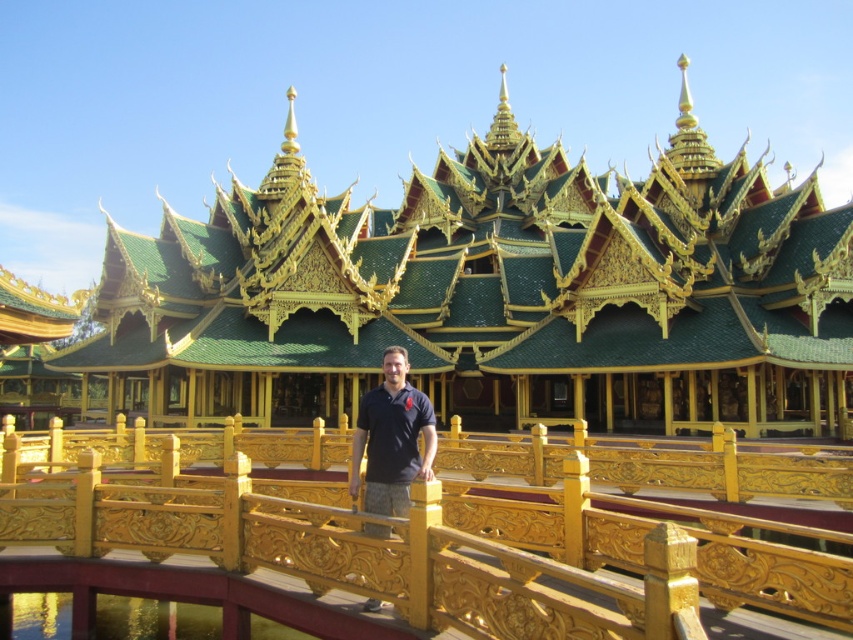
You are standing on the golden bridge and want to walk towards the temple. Which point, point (567,358) or point (357,444), is closer to the temple?

Point (357,444) is closer to the temple because it is in front of point (567,358), which is behind it.

In the scene shown: You are a tourist standing on the golden bridge and want to take a photo of the green glazed tile palace at center. The gold polished wood rail at center is in your way. Can you estimate whether the palace is wider than the rail?

The green glazed tile palace at center might be wider than gold polished wood rail at center, so there is a possibility that the palace is wider than the rail. However, since the palace is at the center and the rail is also at center, their positions might overlap, making it difficult to determine without more information.

In the scene shown: You are a tourist visiting the temple and want to take a photo of the green glazed tile palace at center and the dark blue polo shirt at center. Which object should you focus on first if you want to capture both in the same frame without moving the camera?

The green glazed tile palace at center is located above the dark blue polo shirt at center, so you should focus on the dark blue polo shirt at center first to ensure both are in the frame without moving the camera.